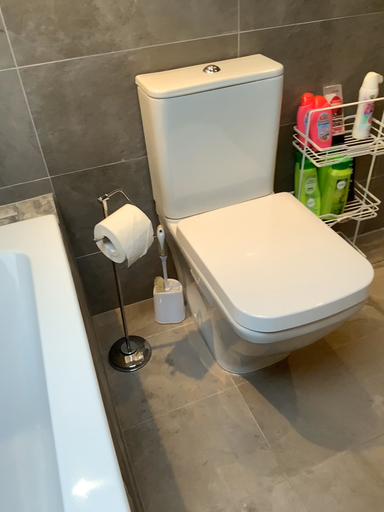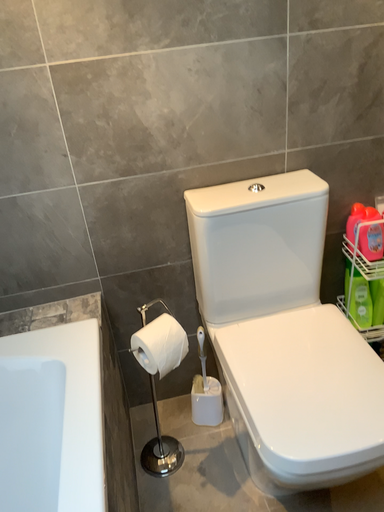
Question: How did the camera likely rotate when shooting the video?

Choices:
 (A) rotated upward
 (B) rotated downward

Answer: (A)